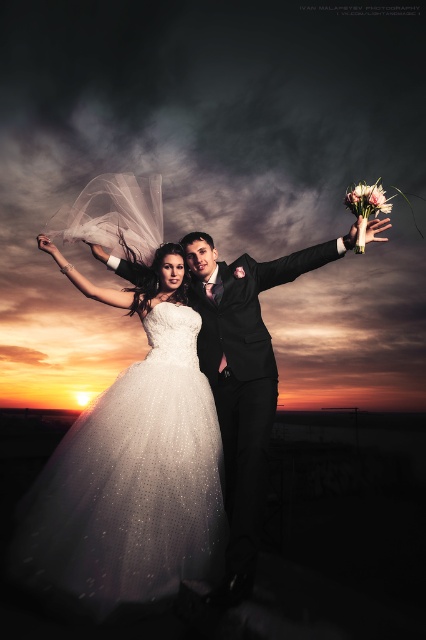
You are a photographer at the wedding. You need to adjust your camera focus to capture both the shiny black suit at center and the pink silk bouquet at upper right. Which object should you focus on first to ensure both are in focus?

You should focus on the shiny black suit at center first because it is closer to the viewer than the pink silk bouquet at upper right, so adjusting focus from near to far will help both be in focus.

Based on the scene description, which object is smaller in size between the satin white gown at center and the shiny black suit at center?

The satin white gown at center is smaller in size compared to the shiny black suit at center according to the description.

You are standing in the wedding scene and want to move from the point closer to you to the point further away. Which path would you take between the two points, point (196, 515) and point (385, 205)?

The path from point (196, 515) to point (385, 205) requires moving away from the viewer since point (196, 515) is closer to the viewer than point (385, 205).